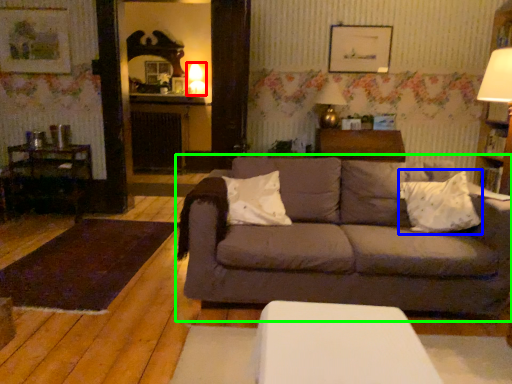
Question: Which object is positioned closest to table lamp (highlighted by a red box)? Select from throw pillow (highlighted by a blue box) and studio couch (highlighted by a green box).

Choices:
 (A) throw pillow
 (B) studio couch

Answer: (B)